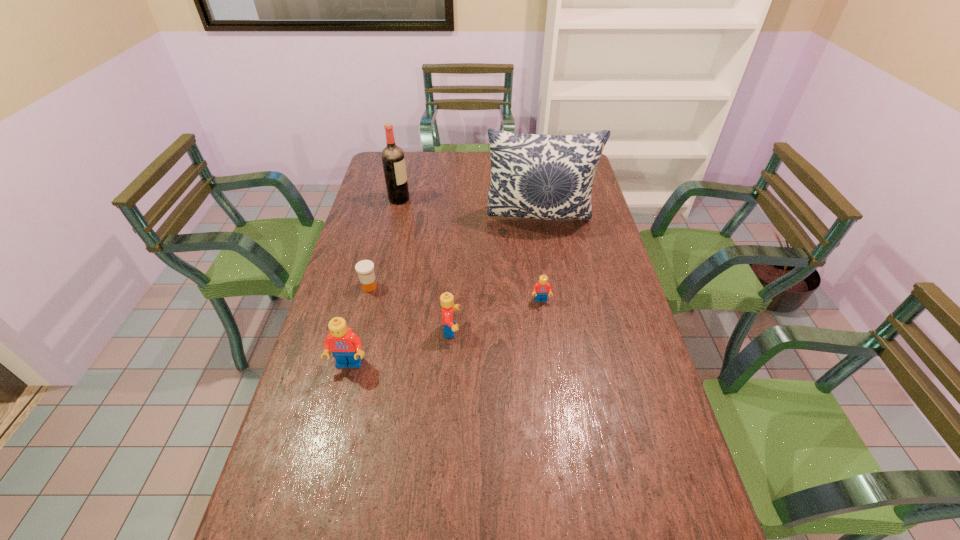
This screenshot has height=540, width=960. What are the coordinates of `the leftmost Lego` in the screenshot? It's located at (346, 346).

The height and width of the screenshot is (540, 960). In order to click on the nearest Lego in this screenshot , I will do `click(346, 346)`.

This screenshot has height=540, width=960. What are the coordinates of `the second farthest Lego` in the screenshot? It's located at point(446,299).

Identify the location of the second shortest Lego. The width and height of the screenshot is (960, 540). (446, 299).

Identify the location of the third nearest object. This screenshot has width=960, height=540. (542, 288).

You are a GUI agent. You are given a task and a screenshot of the screen. Output one action in this format:
    pyautogui.click(x=<x>, y=<y>)
    Task: Click on the farthest Lego
    
    Given the screenshot: What is the action you would take?
    pyautogui.click(x=542, y=288)

Locate an element on the screen. liquor is located at coordinates (393, 159).

Image resolution: width=960 pixels, height=540 pixels. I want to click on cushion, so click(536, 176).

Locate an element on the screen. The image size is (960, 540). medicine is located at coordinates (365, 268).

At what (x,y) coordinates should I click in order to perform the action: click on vacant space located 0.160m on the face of the nearest object. Please return your answer as a coordinate pair (x, y). This screenshot has height=540, width=960. Looking at the image, I should click on (332, 430).